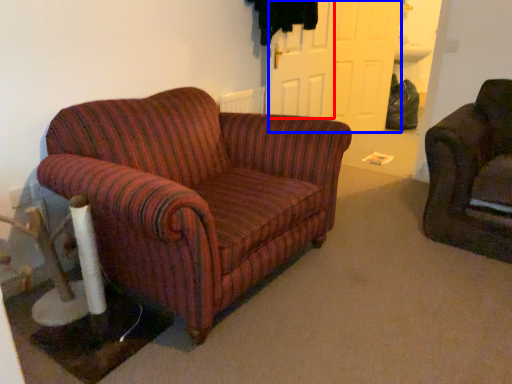
Question: Which point is further to the camera, door (highlighted by a red box) or door (highlighted by a blue box)?

Choices:
 (A) door
 (B) door

Answer: (B)